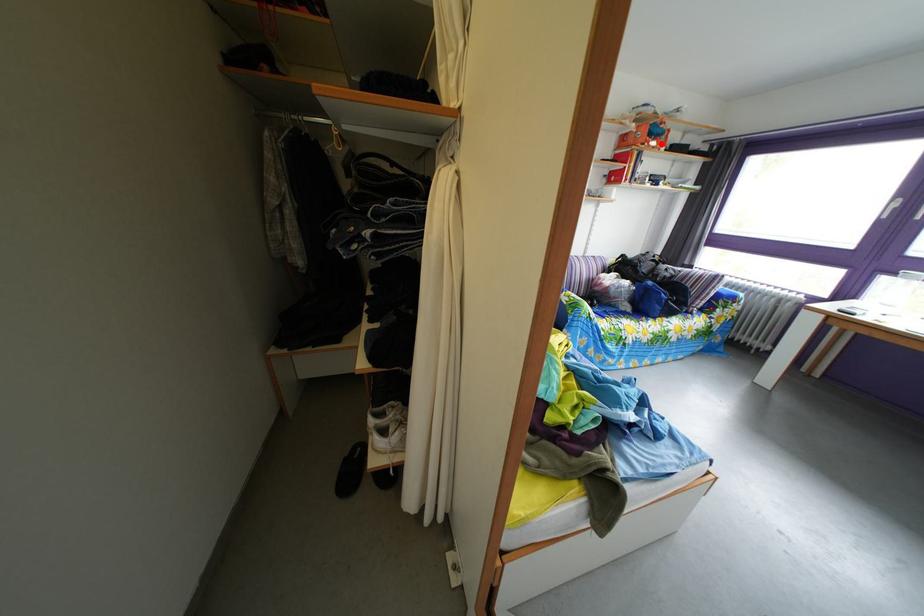
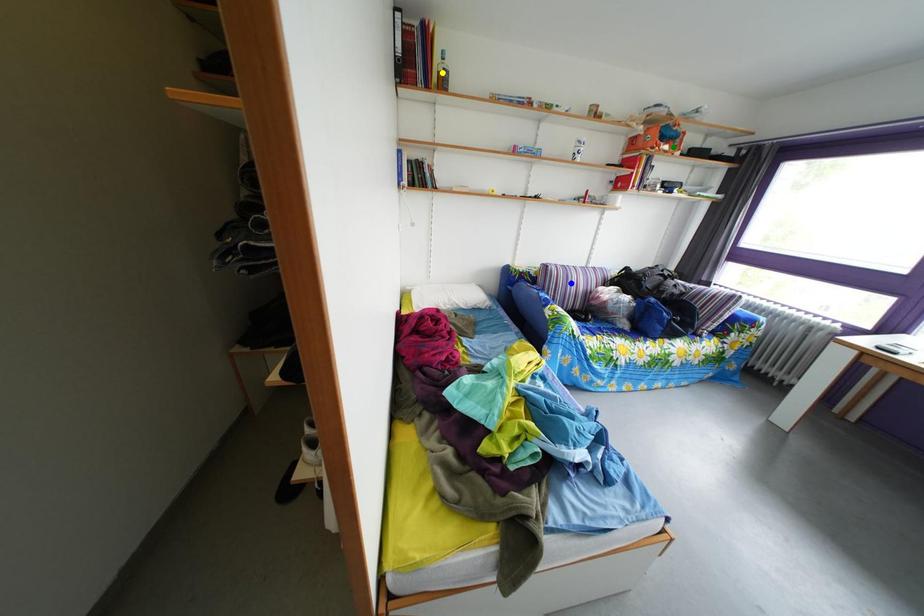
Question: I am providing you with two images of the same scene from different viewpoints. A red point is marked on the first image. You are given multiple points on the second image. Which point in image 2 represents the same 3d spot as the red point in image 1?

Choices:
 (A) blue point
 (B) green point
 (C) yellow point

Answer: (B)